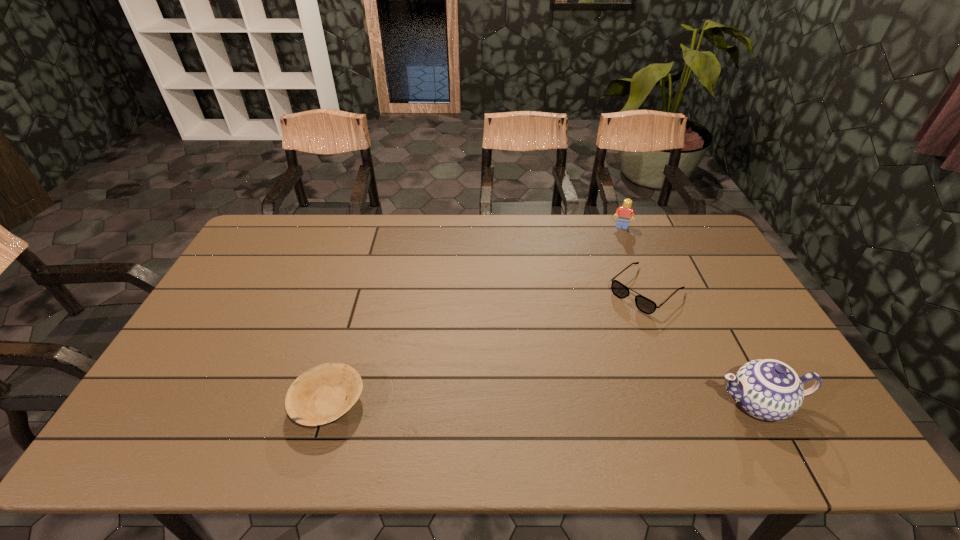
Image resolution: width=960 pixels, height=540 pixels. In the image, there is a desktop. What are the coordinates of `vacant space at the far edge` in the screenshot? It's located at (343, 221).

Identify the location of vacant space at the near edge. (584, 392).

Find the location of `blank space at the left edge of the desktop`. blank space at the left edge of the desktop is located at coordinates (238, 294).

This screenshot has width=960, height=540. In the image, there is a desktop. In order to click on free region at the far left corner in this screenshot , I will do `click(280, 253)`.

Find the location of a particular element. Image resolution: width=960 pixels, height=540 pixels. free point between the spectacles and the Lego is located at coordinates (634, 258).

Where is `empty space that is in between the second farthest object and the leftmost object`? Image resolution: width=960 pixels, height=540 pixels. empty space that is in between the second farthest object and the leftmost object is located at coordinates (488, 347).

You are a GUI agent. You are given a task and a screenshot of the screen. Output one action in this format:
    pyautogui.click(x=<x>, y=<y>)
    Task: Click on the free spot between the bowl and the chinaware
    The width and height of the screenshot is (960, 540).
    Given the screenshot: What is the action you would take?
    pyautogui.click(x=543, y=403)

Identify the location of empty location between the tallest object and the farthest object. Image resolution: width=960 pixels, height=540 pixels. (689, 314).

You are a GUI agent. You are given a task and a screenshot of the screen. Output one action in this format:
    pyautogui.click(x=<x>, y=<y>)
    Task: Click on the unoccupied position between the Lego and the tallest object
    Image resolution: width=960 pixels, height=540 pixels.
    Given the screenshot: What is the action you would take?
    pyautogui.click(x=689, y=314)

You are a GUI agent. You are given a task and a screenshot of the screen. Output one action in this format:
    pyautogui.click(x=<x>, y=<y>)
    Task: Click on the vacant area between the tallest object and the third nearest object
    The image size is (960, 540).
    Given the screenshot: What is the action you would take?
    pyautogui.click(x=702, y=346)